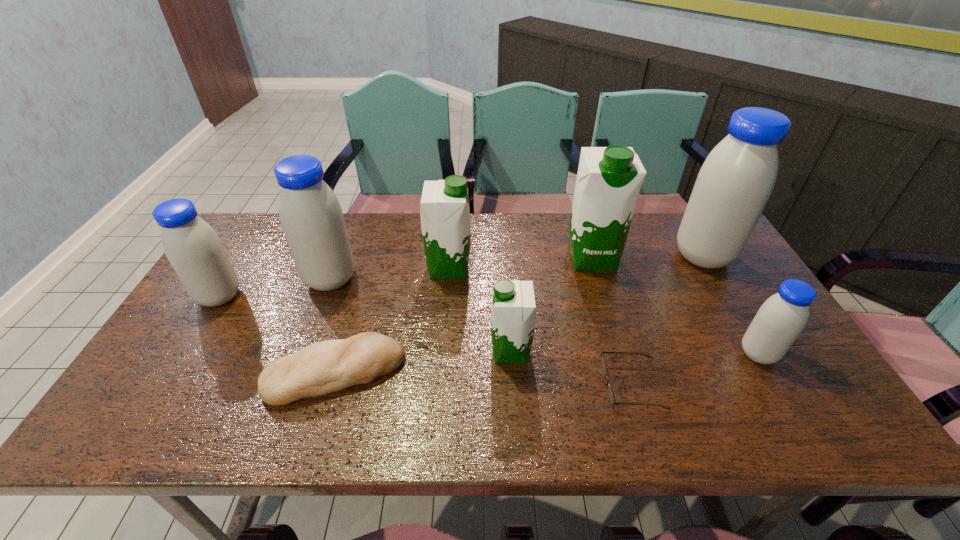
Identify the location of the tallest soya milk. This screenshot has height=540, width=960. (737, 178).

At what (x,y) coordinates should I click in order to perform the action: click on the tallest object. Please return your answer as a coordinate pair (x, y). Image resolution: width=960 pixels, height=540 pixels. Looking at the image, I should click on (737, 178).

Image resolution: width=960 pixels, height=540 pixels. Identify the location of the fifth soya milk from left to right. (609, 179).

You are a GUI agent. You are given a task and a screenshot of the screen. Output one action in this format:
    pyautogui.click(x=<x>, y=<y>)
    Task: Click on the biggest green soya milk
    
    Given the screenshot: What is the action you would take?
    pyautogui.click(x=609, y=179)

Locate an element on the screen. This screenshot has width=960, height=540. the second soya milk from left to right is located at coordinates (311, 217).

The image size is (960, 540). Identify the location of the third smallest blue soya milk. (311, 217).

Where is `the fifth soya milk from right to left`? the fifth soya milk from right to left is located at coordinates (444, 211).

Locate an element on the screen. This screenshot has height=540, width=960. the fourth object from left to right is located at coordinates (444, 211).

The width and height of the screenshot is (960, 540). Identify the location of the second smallest blue soya milk. (193, 248).

Identify the location of the leftmost object. The width and height of the screenshot is (960, 540). (193, 248).